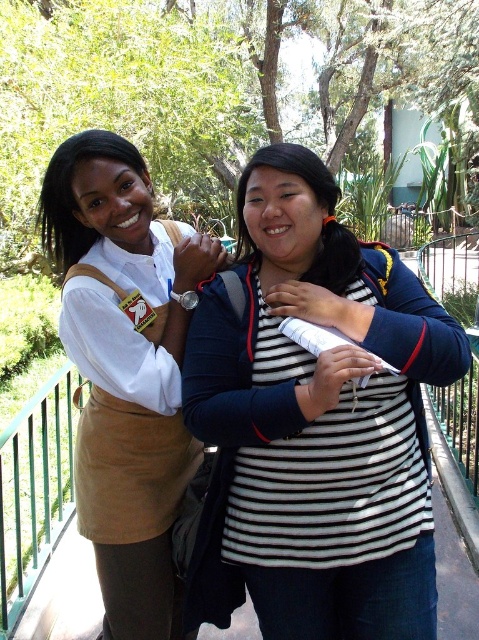
How much distance is there between black striped shirt at center and matte khaki skirt at center?

The distance of black striped shirt at center from matte khaki skirt at center is 20.27 inches.

Describe the element at coordinates (315, 422) in the screenshot. I see `black striped shirt at center` at that location.

At what (x,y) coordinates should I click in order to perform the action: click on black striped shirt at center. Please return your answer as a coordinate pair (x, y). Looking at the image, I should click on (315, 422).

This screenshot has width=479, height=640. I want to click on black striped shirt at center, so click(x=315, y=422).